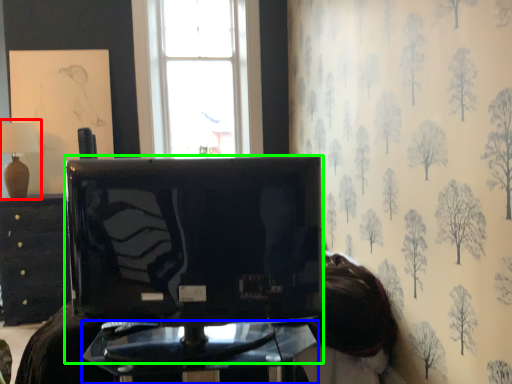
Question: Estimate the real-world distances between objects in this image. Which object is farther from table lamp (highlighted by a red box), furniture (highlighted by a blue box) or television (highlighted by a green box)?

Choices:
 (A) furniture
 (B) television

Answer: (A)